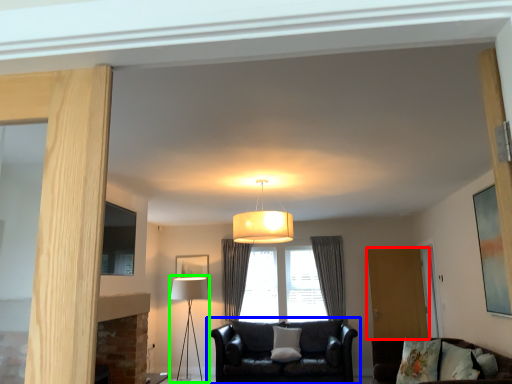
Question: Based on their relative distances, which object is nearer to screen door (highlighted by a red box)? Choose from studio couch (highlighted by a blue box) and table lamp (highlighted by a green box).

Choices:
 (A) studio couch
 (B) table lamp

Answer: (A)